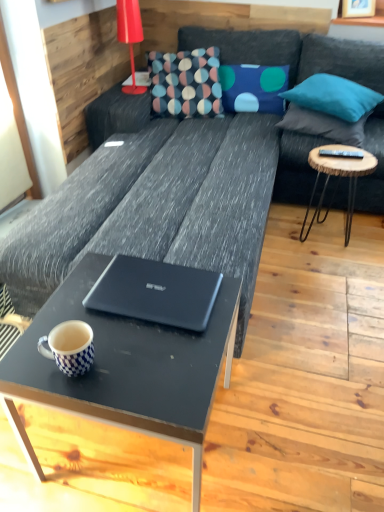
Question: Should I look upward or downward to see matte red lamp at upper left?

Choices:
 (A) down
 (B) up

Answer: (B)

Question: Should I look upward or downward to see multicolored fabric pillow at center?

Choices:
 (A) up
 (B) down

Answer: (A)

Question: Is teal fabric pillow at upper right, the second pillow viewed from the right, oriented away from white checkered mug at lower left?

Choices:
 (A) no
 (B) yes

Answer: (A)

Question: Is white checkered mug at lower left inside teal fabric pillow at upper right, the second pillow viewed from the right?

Choices:
 (A) yes
 (B) no

Answer: (B)

Question: Considering the relative sizes of teal fabric pillow at upper right, the second pillow viewed from the right, and white checkered mug at lower left in the image provided, is teal fabric pillow at upper right, the second pillow viewed from the right, thinner than white checkered mug at lower left?

Choices:
 (A) yes
 (B) no

Answer: (B)

Question: Can you confirm if teal fabric pillow at upper right, which appears as the second pillow when viewed from the left, is bigger than white checkered mug at lower left?

Choices:
 (A) yes
 (B) no

Answer: (A)

Question: Is teal fabric pillow at upper right, the second pillow viewed from the right, positioned beyond the bounds of white checkered mug at lower left?

Choices:
 (A) yes
 (B) no

Answer: (A)

Question: From a real-world perspective, does teal fabric pillow at upper right, the second pillow viewed from the right, sit lower than white checkered mug at lower left?

Choices:
 (A) no
 (B) yes

Answer: (A)

Question: Is wooden round side table at right to the left of matte black laptop at center from the viewer's perspective?

Choices:
 (A) yes
 (B) no

Answer: (B)

Question: From a real-world perspective, is wooden round side table at right physically below matte black laptop at center?

Choices:
 (A) yes
 (B) no

Answer: (A)

Question: Does wooden round side table at right have a larger size compared to matte black laptop at center?

Choices:
 (A) yes
 (B) no

Answer: (A)

Question: Can you confirm if wooden round side table at right is positioned to the right of matte black laptop at center?

Choices:
 (A) no
 (B) yes

Answer: (B)

Question: Is wooden round side table at right outside matte black laptop at center?

Choices:
 (A) yes
 (B) no

Answer: (A)

Question: Does wooden round side table at right have a lesser width compared to matte black laptop at center?

Choices:
 (A) no
 (B) yes

Answer: (B)

Question: Can wooden round side table at right be found inside matte red lamp at upper left?

Choices:
 (A) no
 (B) yes

Answer: (A)